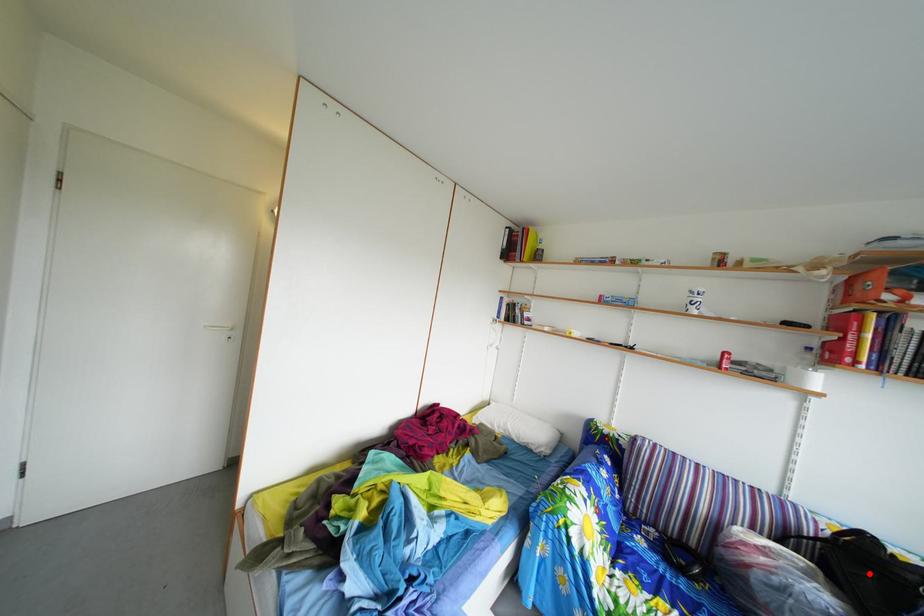
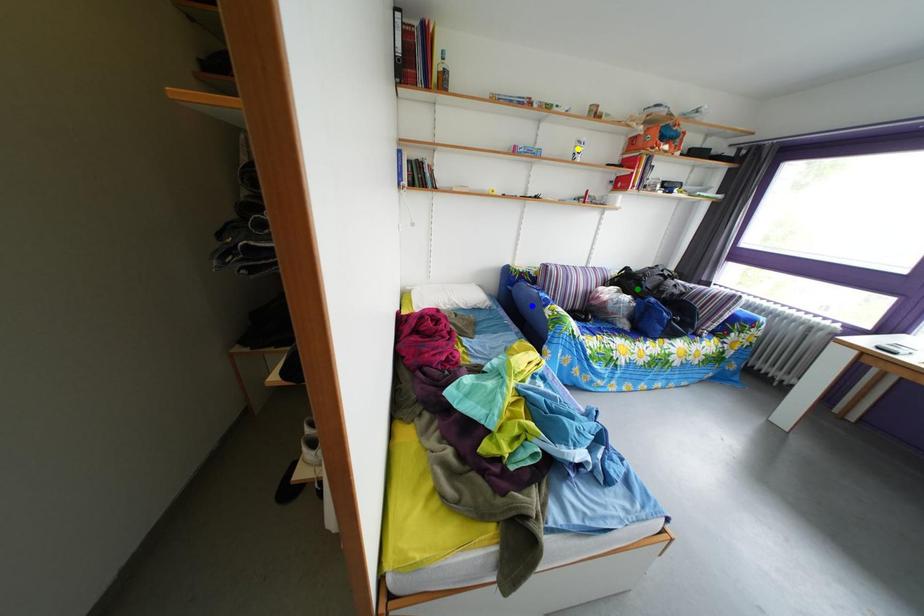
Question: I am providing you with two images of the same scene from different viewpoints. A red point is marked on the first image. You are given multiple points on the second image. Which spot in image 2 lines up with the point in image 1?

Choices:
 (A) blue point
 (B) yellow point
 (C) green point

Answer: (C)